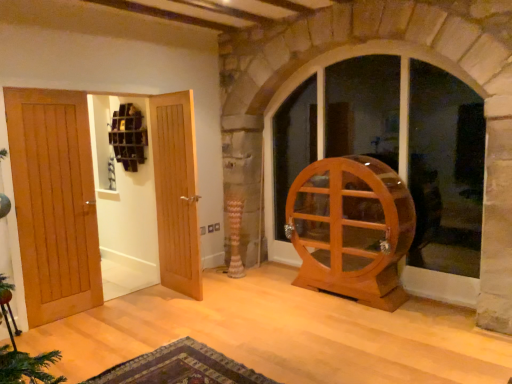
At what (x,y) coordinates should I click in order to perform the action: click on light brown wood door at left, positioned as the 2th door in left-to-right order. Please return your answer as a coordinate pair (x, y). The image size is (512, 384). Looking at the image, I should click on (54, 201).

Image resolution: width=512 pixels, height=384 pixels. I want to click on light brown wood door at center, marked as the 1th door in a right-to-left arrangement, so click(176, 192).

This screenshot has height=384, width=512. What do you see at coordinates (176, 192) in the screenshot?
I see `light brown wood door at center, marked as the 1th door in a right-to-left arrangement` at bounding box center [176, 192].

What do you see at coordinates (180, 367) in the screenshot?
I see `carpeted rug at lower center` at bounding box center [180, 367].

Identify the location of light brown wood door at left, which appears as the 2th door when viewed from the right. (54, 201).

Would you say light brown wood door at left, which appears as the 2th door when viewed from the right, is outside light brown wood hamster wheel at right?

Answer: light brown wood door at left, which appears as the 2th door when viewed from the right, is positioned outside light brown wood hamster wheel at right.

Where is `door that is the 2nd one when counting upward from the light brown wood hamster wheel at right (from the image's perspective)`? The height and width of the screenshot is (384, 512). door that is the 2nd one when counting upward from the light brown wood hamster wheel at right (from the image's perspective) is located at coordinates (54, 201).

Is light brown wood door at left, which appears as the 2th door when viewed from the right, oriented towards light brown wood hamster wheel at right?

No, light brown wood door at left, which appears as the 2th door when viewed from the right, is not oriented towards light brown wood hamster wheel at right.

Is the depth of light brown wood door at left, which appears as the 2th door when viewed from the right, less than that of light brown wood hamster wheel at right?

Yes, it is.

In terms of height, does carpeted rug at lower center look taller or shorter compared to light brown wood door at left, the 3th door in the right-to-left sequence?

In the image, carpeted rug at lower center appears to be shorter than light brown wood door at left, the 3th door in the right-to-left sequence.

Are carpeted rug at lower center and light brown wood door at left, the 1th door viewed from the left, making contact?

carpeted rug at lower center and light brown wood door at left, the 1th door viewed from the left, are clearly separated.

Is carpeted rug at lower center positioned in front of light brown wood door at left, the 1th door viewed from the left?

Yes, it is in front of light brown wood door at left, the 1th door viewed from the left.

Considering the relative positions of carpeted rug at lower center and light brown wood hamster wheel at right in the image provided, is carpeted rug at lower center to the right of light brown wood hamster wheel at right from the viewer's perspective?

In fact, carpeted rug at lower center is to the left of light brown wood hamster wheel at right.

Is carpeted rug at lower center not inside light brown wood hamster wheel at right?

Indeed, carpeted rug at lower center is completely outside light brown wood hamster wheel at right.

Is carpeted rug at lower center oriented away from light brown wood hamster wheel at right?

No.

Is carpeted rug at lower center oriented towards light brown wood door at center, which ranks as the third door in left-to-right order?

No, carpeted rug at lower center is not oriented towards light brown wood door at center, which ranks as the third door in left-to-right order.

Measure the distance from carpeted rug at lower center to light brown wood door at center, marked as the 1th door in a right-to-left arrangement.

4.57 feet.

Is carpeted rug at lower center thinner than light brown wood door at center, marked as the 1th door in a right-to-left arrangement?

No.

From the image's perspective, relative to carpeted rug at lower center, is light brown wood door at left, the 1th door viewed from the left, above or below?

Clearly, from the image's perspective, light brown wood door at left, the 1th door viewed from the left, is above carpeted rug at lower center.

Considering the sizes of light brown wood door at left, the 3th door in the right-to-left sequence, and carpeted rug at lower center in the image, is light brown wood door at left, the 3th door in the right-to-left sequence, bigger or smaller than carpeted rug at lower center?

light brown wood door at left, the 3th door in the right-to-left sequence, is bigger than carpeted rug at lower center.

Is light brown wood door at left, the 3th door in the right-to-left sequence, located outside carpeted rug at lower center?

Absolutely, light brown wood door at left, the 3th door in the right-to-left sequence, is external to carpeted rug at lower center.

Is light brown wood door at left, the 3th door in the right-to-left sequence, next to carpeted rug at lower center?

light brown wood door at left, the 3th door in the right-to-left sequence, and carpeted rug at lower center are not in contact.

Relative to light brown wood door at left, positioned as the 2th door in left-to-right order, is carpeted rug at lower center in front or behind?

Clearly, carpeted rug at lower center is in front of light brown wood door at left, positioned as the 2th door in left-to-right order.

Is carpeted rug at lower center facing away from light brown wood door at left, which appears as the 2th door when viewed from the right?

Yes.

Is carpeted rug at lower center smaller than light brown wood door at left, positioned as the 2th door in left-to-right order?

Indeed, carpeted rug at lower center has a smaller size compared to light brown wood door at left, positioned as the 2th door in left-to-right order.

Who is taller, carpeted rug at lower center or light brown wood door at left, positioned as the 2th door in left-to-right order?

Standing taller between the two is light brown wood door at left, positioned as the 2th door in left-to-right order.

Is transparent glass cabinet at center facing towards light brown wood hamster wheel at right?

Yes, transparent glass cabinet at center faces towards light brown wood hamster wheel at right.

Measure the distance from transparent glass cabinet at center to light brown wood hamster wheel at right.

transparent glass cabinet at center is 1.00 meters away from light brown wood hamster wheel at right.

Could light brown wood hamster wheel at right be considered to be inside transparent glass cabinet at center?

No, light brown wood hamster wheel at right is not inside transparent glass cabinet at center.

Considering the relative positions of transparent glass cabinet at center and light brown wood hamster wheel at right in the image provided, is transparent glass cabinet at center to the left or to the right of light brown wood hamster wheel at right?

transparent glass cabinet at center is positioned on light brown wood hamster wheel at right's right side.

In the image, there is a light brown wood door at left, which appears as the 2th door when viewed from the right. Where is `furniture below it (from a real-world perspective)`? furniture below it (from a real-world perspective) is located at coordinates (351, 229).

This screenshot has height=384, width=512. Identify the location of doormat lying on the right of light brown wood door at left, the 3th door in the right-to-left sequence. (180, 367).

Considering their positions, is carpeted rug at lower center positioned closer to light brown wood door at left, the 3th door in the right-to-left sequence, than transparent glass cabinet at center?

The object closer to light brown wood door at left, the 3th door in the right-to-left sequence, is carpeted rug at lower center.

Which object lies nearer to the anchor point carpeted rug at lower center, light brown wood door at left, positioned as the 2th door in left-to-right order, or light brown wood hamster wheel at right?

light brown wood door at left, positioned as the 2th door in left-to-right order, is closer to carpeted rug at lower center.

Which object lies nearer to the anchor point transparent glass cabinet at center, carpeted rug at lower center or light brown wood door at left, positioned as the 2th door in left-to-right order?

Among the two, carpeted rug at lower center is located nearer to transparent glass cabinet at center.

Looking at the image, which one is located further to transparent glass cabinet at center, light brown wood door at left, the 3th door in the right-to-left sequence, or light brown wood door at center, marked as the 1th door in a right-to-left arrangement?

light brown wood door at left, the 3th door in the right-to-left sequence, is further to transparent glass cabinet at center.

Which object lies nearer to the anchor point light brown wood hamster wheel at right, transparent glass cabinet at center or light brown wood door at left, which appears as the 2th door when viewed from the right?

Based on the image, transparent glass cabinet at center appears to be nearer to light brown wood hamster wheel at right.

From the image, which object appears to be farther from light brown wood door at left, the 3th door in the right-to-left sequence, light brown wood door at left, which appears as the 2th door when viewed from the right, or carpeted rug at lower center?

The object further to light brown wood door at left, the 3th door in the right-to-left sequence, is carpeted rug at lower center.

Based on their spatial positions, is light brown wood door at left, the 3th door in the right-to-left sequence, or light brown wood door at center, which ranks as the third door in left-to-right order, further from light brown wood hamster wheel at right?

light brown wood door at left, the 3th door in the right-to-left sequence, is further to light brown wood hamster wheel at right.

Based on their spatial positions, is transparent glass cabinet at center or light brown wood door at left, the 3th door in the right-to-left sequence, closer to light brown wood door at left, which appears as the 2th door when viewed from the right?

Based on the image, light brown wood door at left, the 3th door in the right-to-left sequence, appears to be nearer to light brown wood door at left, which appears as the 2th door when viewed from the right.

Identify the location of furniture between light brown wood door at left, the 3th door in the right-to-left sequence, and transparent glass cabinet at center, in the horizontal direction. Image resolution: width=512 pixels, height=384 pixels. (351, 229).

Find the location of a particular element. furniture between light brown wood door at center, marked as the 1th door in a right-to-left arrangement, and transparent glass cabinet at center is located at coordinates (351, 229).

Identify the location of doormat situated between light brown wood door at left, which appears as the 2th door when viewed from the right, and light brown wood hamster wheel at right from left to right. The width and height of the screenshot is (512, 384). (180, 367).

Find the location of a particular element. The height and width of the screenshot is (384, 512). doormat located between light brown wood door at center, which ranks as the third door in left-to-right order, and transparent glass cabinet at center in the left-right direction is located at coordinates (180, 367).